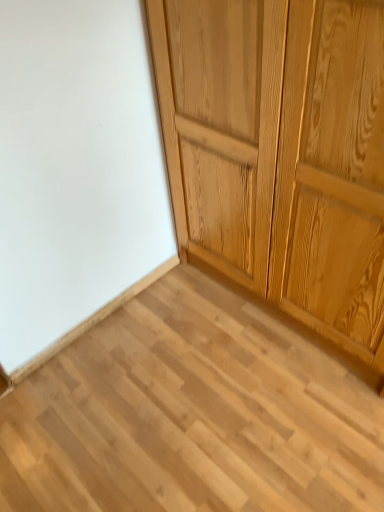
Measure the distance between point (373,106) and camera.

Point (373,106) and camera are 36.18 inches apart.

What is the approximate height of light brown wood cupboard at upper right?

light brown wood cupboard at upper right is 3.78 feet in height.

Find the location of a particular element. The height and width of the screenshot is (512, 384). light brown wood cupboard at upper right is located at coordinates (281, 153).

Describe the element at coordinates (281, 153) in the screenshot. I see `light brown wood cupboard at upper right` at that location.

In order to face light wood plank at center, should I rotate leftwards or rightwards?

Rotate your view left by about 0.409°.

Where is `light wood plank at center`? The image size is (384, 512). light wood plank at center is located at coordinates (191, 414).

The width and height of the screenshot is (384, 512). What do you see at coordinates (191, 414) in the screenshot?
I see `light wood plank at center` at bounding box center [191, 414].

Locate an element on the screen. light brown wood cupboard at upper right is located at coordinates (281, 153).

Which object is positioned more to the left, light brown wood cupboard at upper right or light wood plank at center?

light wood plank at center.

From the picture: Which object is more forward, light brown wood cupboard at upper right or light wood plank at center?

light brown wood cupboard at upper right is more forward.

Which point is more forward, [223,136] or [225,432]?

Positioned in front is point [223,136].

From the image's perspective, which one is positioned higher, light brown wood cupboard at upper right or light wood plank at center?

light brown wood cupboard at upper right, from the image's perspective.

From a real-world perspective, is light brown wood cupboard at upper right above or below light wood plank at center?

light brown wood cupboard at upper right is above light wood plank at center.

In terms of width, does light brown wood cupboard at upper right look wider or thinner when compared to light wood plank at center?

In the image, light brown wood cupboard at upper right appears to be more narrow than light wood plank at center.

Is light brown wood cupboard at upper right shorter than light wood plank at center?

No, light brown wood cupboard at upper right is not shorter than light wood plank at center.

Is light brown wood cupboard at upper right bigger or smaller than light wood plank at center?

Considering their sizes, light brown wood cupboard at upper right takes up more space than light wood plank at center.

Would you say light brown wood cupboard at upper right is inside or outside light wood plank at center?

light brown wood cupboard at upper right lies outside light wood plank at center.

Is light brown wood cupboard at upper right far away from light wood plank at center?

Actually, light brown wood cupboard at upper right and light wood plank at center are a little close together.

Is light brown wood cupboard at upper right looking in the opposite direction of light wood plank at center?

light brown wood cupboard at upper right does not have its back to light wood plank at center.

You are a GUI agent. You are given a task and a screenshot of the screen. Output one action in this format:
    pyautogui.click(x=<x>, y=<y>)
    Task: Click on the cupboard that is above the light wood plank at center (from the image's perspective)
    Image resolution: width=384 pixels, height=512 pixels.
    Given the screenshot: What is the action you would take?
    pyautogui.click(x=281, y=153)

Considering the relative positions of light wood plank at center and light brown wood cupboard at upper right in the image provided, is light wood plank at center to the right of light brown wood cupboard at upper right from the viewer's perspective?

No, light wood plank at center is not to the right of light brown wood cupboard at upper right.

Which is in front, light wood plank at center or light brown wood cupboard at upper right?

light brown wood cupboard at upper right.

Which is in front, point (288, 359) or point (216, 181)?

Point (216, 181)

Consider the image. From the image's perspective, between light wood plank at center and light brown wood cupboard at upper right, which one is located above?

light brown wood cupboard at upper right, from the image's perspective.

From a real-world perspective, which is physically below, light wood plank at center or light brown wood cupboard at upper right?

In real-world perspective, light wood plank at center is lower.

Which of these two, light wood plank at center or light brown wood cupboard at upper right, is wider?

light wood plank at center.

Considering the sizes of objects light wood plank at center and light brown wood cupboard at upper right in the image provided, who is shorter, light wood plank at center or light brown wood cupboard at upper right?

light wood plank at center.

Who is bigger, light wood plank at center or light brown wood cupboard at upper right?

Bigger between the two is light brown wood cupboard at upper right.

Do you think light wood plank at center is within light brown wood cupboard at upper right, or outside of it?

light wood plank at center is not inside light brown wood cupboard at upper right, it's outside.

Are light wood plank at center and light brown wood cupboard at upper right making contact?

No, light wood plank at center is not touching light brown wood cupboard at upper right.

Is light wood plank at center facing towards light brown wood cupboard at upper right?

No, light wood plank at center is not facing towards light brown wood cupboard at upper right.

Consider the image. How different are the orientations of light wood plank at center and light brown wood cupboard at upper right in degrees?

light wood plank at center and light brown wood cupboard at upper right are facing 90.4 degrees away from each other.

You are a GUI agent. You are given a task and a screenshot of the screen. Output one action in this format:
    pyautogui.click(x=<x>, y=<y>)
    Task: Click on the cupboard above the light wood plank at center (from the image's perspective)
    
    Given the screenshot: What is the action you would take?
    pyautogui.click(x=281, y=153)

Locate an element on the screen. The image size is (384, 512). cupboard that is in front of the light wood plank at center is located at coordinates (281, 153).

At what (x,y) coordinates should I click in order to perform the action: click on plank that appears below the light brown wood cupboard at upper right (from the image's perspective). Please return your answer as a coordinate pair (x, y). Image resolution: width=384 pixels, height=512 pixels. Looking at the image, I should click on (191, 414).